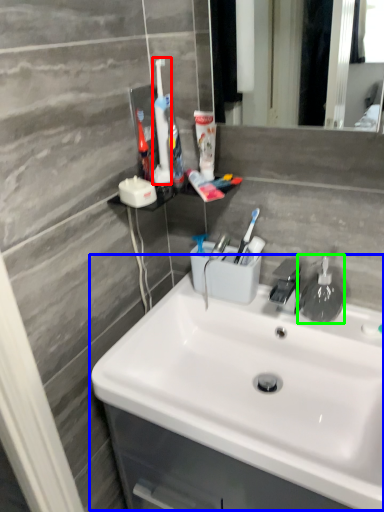
Question: Considering the real-world distances, which object is closest to toothbrush (highlighted by a red box)? sink (highlighted by a blue box) or soap dispenser (highlighted by a green box).

Choices:
 (A) sink
 (B) soap dispenser

Answer: (B)